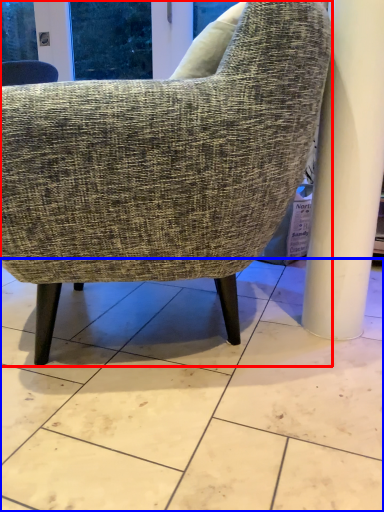
Question: Which point is further to the camera, chair (highlighted by a red box) or concrete (highlighted by a blue box)?

Choices:
 (A) chair
 (B) concrete

Answer: (A)